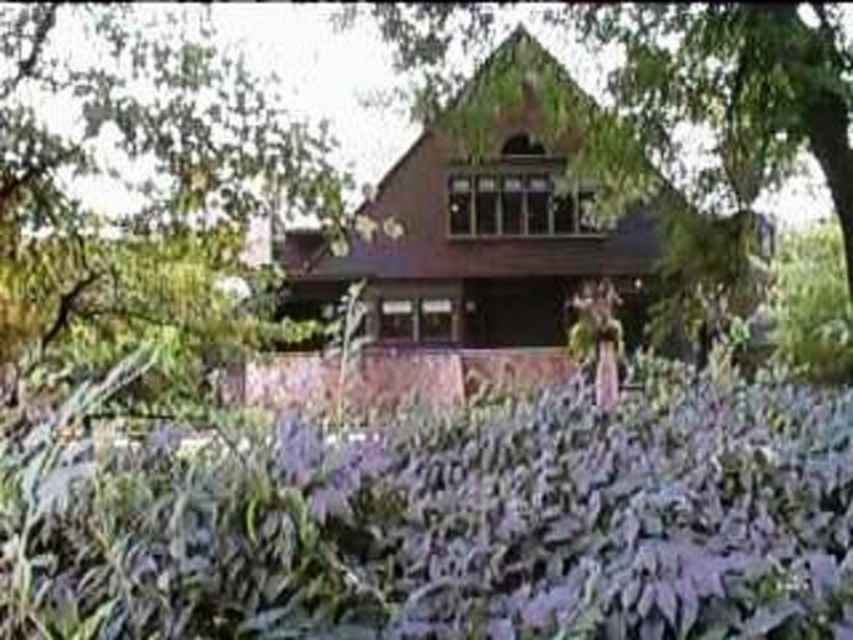
Which is more to the left, green leafy tree at upper center or green leafy tree at center?

From the viewer's perspective, green leafy tree at upper center appears more on the left side.

Does green leafy tree at upper center have a lesser height compared to green leafy tree at center?

Yes.

Does point (202, 148) lie in front of point (743, 93)?

Yes, point (202, 148) is in front of point (743, 93).

Locate an element on the screen. green leafy tree at upper center is located at coordinates (149, 193).